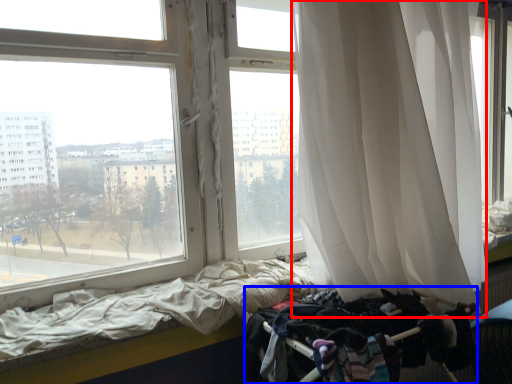
Question: Which object is further to the camera taking this photo, curtain (highlighted by a red box) or baby carriage (highlighted by a blue box)?

Choices:
 (A) curtain
 (B) baby carriage

Answer: (B)